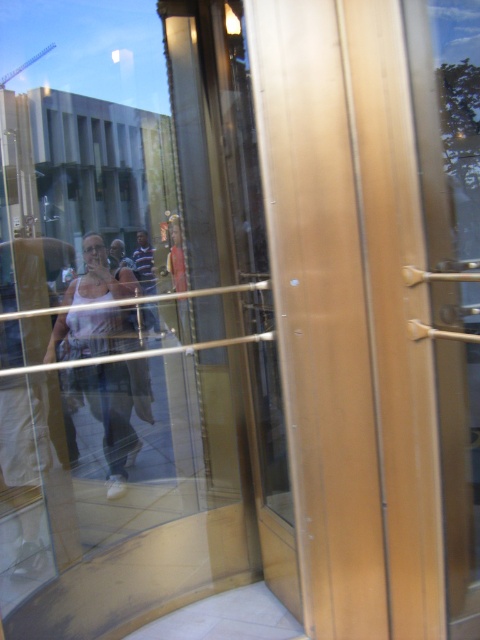
You are a fashion designer observing the revolving door scene. You notice two items of clothing at the center of the revolving door reflections. Which clothing item appears taller between the striped shirt at center and the light brown leather jacket at center?

The striped shirt at center has a greater height compared to the light brown leather jacket at center, so the striped shirt at center appears taller.